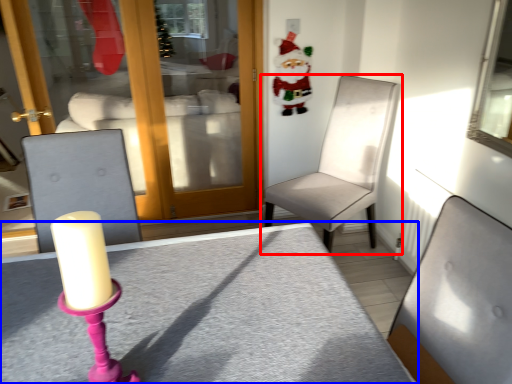
Question: Which point is further to the camera, chair (highlighted by a red box) or table (highlighted by a blue box)?

Choices:
 (A) chair
 (B) table

Answer: (A)